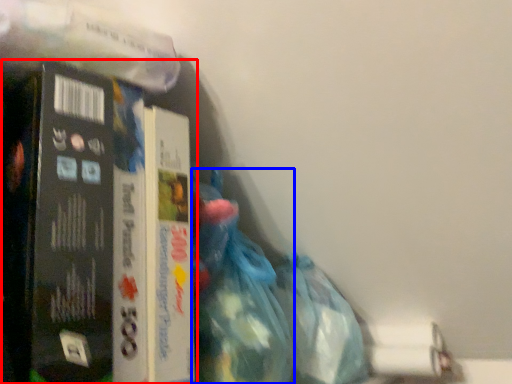
Question: Which of the following is the closest to the observer, book (highlighted by a red box) or waste (highlighted by a blue box)?

Choices:
 (A) book
 (B) waste

Answer: (A)